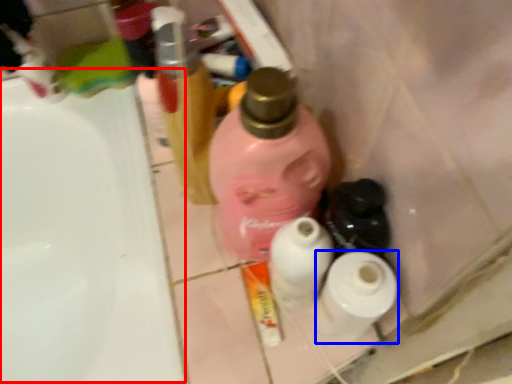
Question: Which of the following is the closest to the observer, sink (highlighted by a red box) or toilet paper (highlighted by a blue box)?

Choices:
 (A) sink
 (B) toilet paper

Answer: (B)